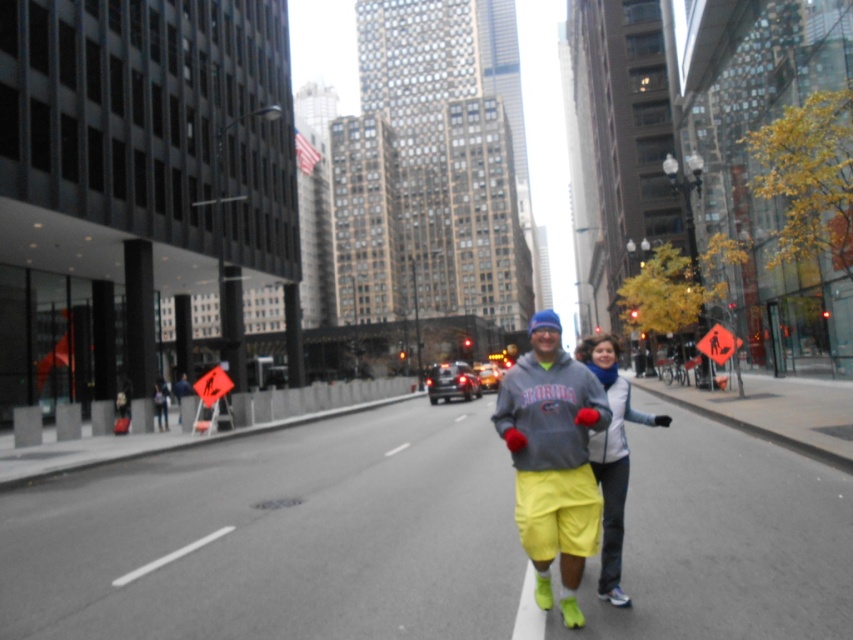
Based on the photo, you are a drone operator tasked with capturing aerial footage of the marathon. The drone has a camera with a 100mm focal length lens. To ensure the runner in the matte gray hoodie at center is in focus, where should you position the drone relative to the other runners?

The matte gray hoodie at center is located at point (564, 460), so the drone should be positioned closer to that coordinate to ensure the runner in the matte gray hoodie at center is in focus.

You are a photographer positioned on the sidewalk capturing the runners in the urban street scene. You notice the matte gray hoodie at center and the yellow fabric pants at center. Which clothing item is positioned higher on the runner?

The matte gray hoodie at center is located above the yellow fabric pants at center, so the matte gray hoodie at center is positioned higher on the runner.

You are a photographer positioned on the street and want to capture both the matte gray hoodie at center and the yellow fabric pants at center in a single frame. Which object should you focus on first to ensure both are in the frame?

The matte gray hoodie at center is taller than the yellow fabric pants at center, so you should focus on the matte gray hoodie at center first to ensure both are captured in the frame.